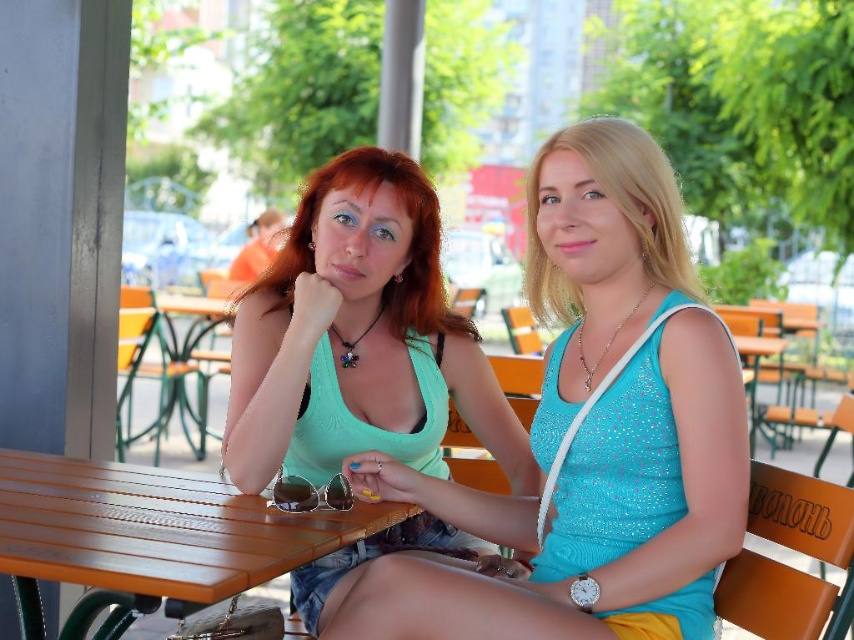
Question: Can you confirm if green matte tank top at center is positioned to the right of wooden table at center?

Choices:
 (A) yes
 (B) no

Answer: (A)

Question: Is green matte tank top at center positioned before wooden table at center?

Choices:
 (A) no
 (B) yes

Answer: (B)

Question: Where is green matte tank top at center located in relation to wooden at center in the image?

Choices:
 (A) below
 (B) above

Answer: (B)

Question: Which point is farther from the camera taking this photo?

Choices:
 (A) (178, 349)
 (B) (443, 321)
 (C) (724, 552)
 (D) (343, 536)

Answer: (A)

Question: Among these objects, which one is farthest from the camera?

Choices:
 (A) wooden at center
 (B) wooden table at center
 (C) matte green tank top at center
 (D) green matte tank top at center

Answer: (B)

Question: Which point is closer to the camera?

Choices:
 (A) green matte tank top at center
 (B) wooden at center

Answer: (B)